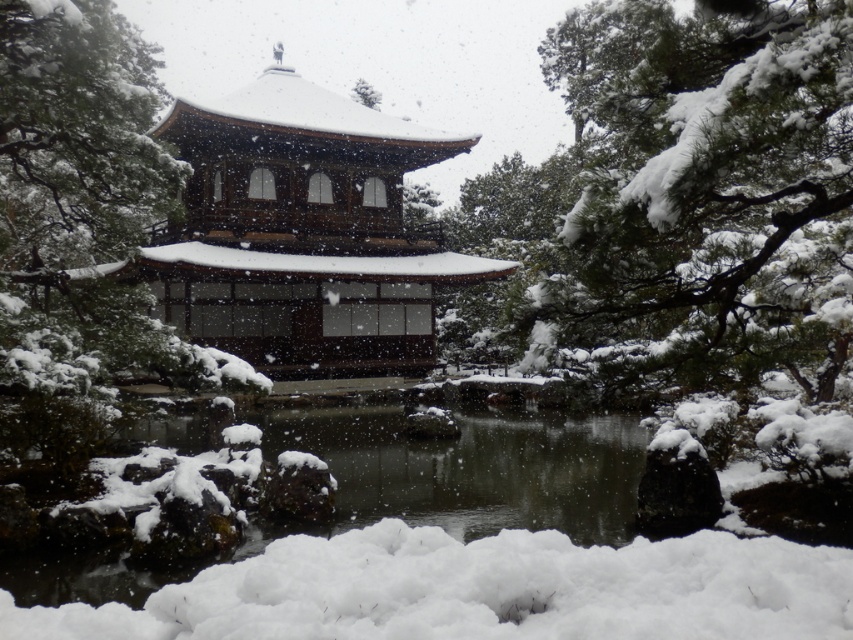
You are an architect designing a snow sculpture. You observe the white smooth pond at center and the white fluffy snow at upper center in the scene. Which of these two has a greater height?

The white fluffy snow at upper center is taller than the white smooth pond at center.